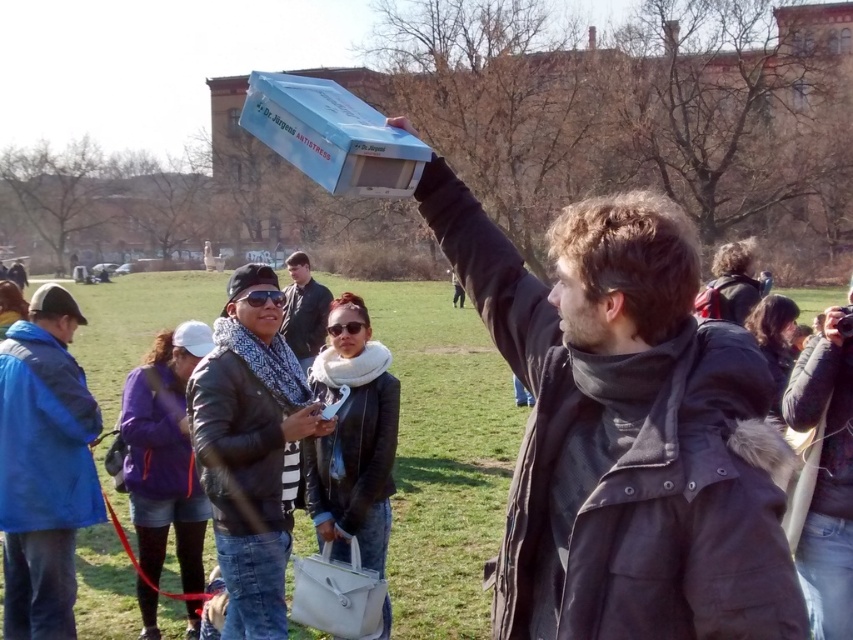
You are a fashion designer observing the park scene. You need to determine which jacket is narrower between the blue fabric jacket at lower left and the leather jacket at center. Which one is narrower?

The blue fabric jacket at lower left is narrower than the leather jacket at center.

You are a fashion designer observing the jackets in the scene. You need to decide if you can place a 1.2 meter long dress between the black leather jacket at center and the blue fabric jacket at lower left. Can you fit the dress between them?

The black leather jacket at center and the blue fabric jacket at lower left are 1.03 meters apart. Since the dress is 1.2 meters long, it cannot fit between them as the distance is shorter than the dress length.